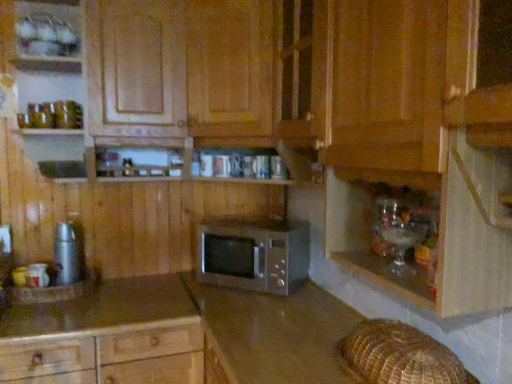
The width and height of the screenshot is (512, 384). Describe the element at coordinates (366, 241) in the screenshot. I see `translucent glassware at lower right` at that location.

The width and height of the screenshot is (512, 384). In order to click on smooth brown countertop at lower left in this screenshot , I will do `click(103, 309)`.

From the image's perspective, which is below, satin silver microwave at center or metallic silver thermos at left?

satin silver microwave at center appears lower in the image.

Is satin silver microwave at center oriented away from metallic silver thermos at left?

No.

Is metallic silver thermos at left inside satin silver microwave at center?

No, metallic silver thermos at left is located outside of satin silver microwave at center.

Does point (258, 224) appear closer or farther from the camera than point (76, 265)?

Point (258, 224) appears to be farther away from the viewer than point (76, 265).

Is satin brown microwave at center, acting as the second cabinetry starting from the top, at the left side of wooden microwave at center, marked as the 2th cabinetry in a bottom-to-top arrangement?

Correct, you'll find satin brown microwave at center, acting as the second cabinetry starting from the top, to the left of wooden microwave at center, marked as the 2th cabinetry in a bottom-to-top arrangement.

Does satin brown microwave at center, acting as the second cabinetry starting from the top, turn towards wooden microwave at center, marked as the 2th cabinetry in a bottom-to-top arrangement?

No, satin brown microwave at center, acting as the second cabinetry starting from the top, does not turn towards wooden microwave at center, marked as the 2th cabinetry in a bottom-to-top arrangement.

In the scene shown: Considering the relative sizes of satin brown microwave at center, the first cabinetry positioned from the bottom, and wooden microwave at center, marked as the 2th cabinetry in a bottom-to-top arrangement, in the image provided, is satin brown microwave at center, the first cabinetry positioned from the bottom, smaller than wooden microwave at center, marked as the 2th cabinetry in a bottom-to-top arrangement,?

Yes, satin brown microwave at center, the first cabinetry positioned from the bottom, is smaller than wooden microwave at center, marked as the 2th cabinetry in a bottom-to-top arrangement.

How many degrees apart are the facing directions of satin brown microwave at center, acting as the second cabinetry starting from the top, and wooden microwave at center, marked as the 2th cabinetry in a bottom-to-top arrangement?

The angular difference between satin brown microwave at center, acting as the second cabinetry starting from the top, and wooden microwave at center, marked as the 2th cabinetry in a bottom-to-top arrangement, is 2.12e-05 degrees.

Is metallic silver thermos at left to the right of wooden microwave at center, placed as the first cabinetry when sorted from top to bottom, from the viewer's perspective?

No, metallic silver thermos at left is not to the right of wooden microwave at center, placed as the first cabinetry when sorted from top to bottom.

Is there a large distance between metallic silver thermos at left and wooden microwave at center, marked as the 2th cabinetry in a bottom-to-top arrangement?

No, metallic silver thermos at left is not far away from wooden microwave at center, marked as the 2th cabinetry in a bottom-to-top arrangement.

Considering the positions of points (73, 265) and (138, 107), is point (73, 265) closer to camera compared to point (138, 107)?

No, it is not.

Considering the sizes of metallic silver thermos at left and wooden microwave at center, placed as the first cabinetry when sorted from top to bottom, in the image, is metallic silver thermos at left wider or thinner than wooden microwave at center, placed as the first cabinetry when sorted from top to bottom,?

metallic silver thermos at left is thinner than wooden microwave at center, placed as the first cabinetry when sorted from top to bottom.

Where is `shelf on the right of smooth brown countertop at lower left`? The width and height of the screenshot is (512, 384). shelf on the right of smooth brown countertop at lower left is located at coordinates (366, 241).

What's the angular difference between smooth brown countertop at lower left and translucent glassware at lower right's facing directions?

The angle between the facing direction of smooth brown countertop at lower left and the facing direction of translucent glassware at lower right is 89.6 degrees.

From the image's perspective, which is above, smooth brown countertop at lower left or translucent glassware at lower right?

translucent glassware at lower right appears higher in the image.

Considering the positions of objects smooth brown countertop at lower left and translucent glassware at lower right in the image provided, who is in front, smooth brown countertop at lower left or translucent glassware at lower right?

translucent glassware at lower right.

Can you tell me how much translucent glassware at lower right and satin brown microwave at center, the first cabinetry positioned from the bottom, differ in facing direction?

0.284 degrees separate the facing orientations of translucent glassware at lower right and satin brown microwave at center, the first cabinetry positioned from the bottom.

Choose the correct answer: Is translucent glassware at lower right inside satin brown microwave at center, acting as the second cabinetry starting from the top, or outside it?

translucent glassware at lower right is not enclosed by satin brown microwave at center, acting as the second cabinetry starting from the top.

Looking at this image, is translucent glassware at lower right oriented towards satin brown microwave at center, acting as the second cabinetry starting from the top?

No, translucent glassware at lower right is not oriented towards satin brown microwave at center, acting as the second cabinetry starting from the top.

Considering the sizes of objects satin silver microwave at center and wooden microwave at center, marked as the 2th cabinetry in a bottom-to-top arrangement, in the image provided, who is shorter, satin silver microwave at center or wooden microwave at center, marked as the 2th cabinetry in a bottom-to-top arrangement,?

With less height is satin silver microwave at center.

From a real-world perspective, is satin silver microwave at center above or below wooden microwave at center, marked as the 2th cabinetry in a bottom-to-top arrangement?

From a real-world perspective, satin silver microwave at center is physically below wooden microwave at center, marked as the 2th cabinetry in a bottom-to-top arrangement.

Looking at their sizes, would you say satin silver microwave at center is wider or thinner than wooden microwave at center, marked as the 2th cabinetry in a bottom-to-top arrangement?

Clearly, satin silver microwave at center has less width compared to wooden microwave at center, marked as the 2th cabinetry in a bottom-to-top arrangement.

Consider the image. Considering the positions of objects satin silver microwave at center and wooden microwave at center, placed as the first cabinetry when sorted from top to bottom, in the image provided, who is more to the right, satin silver microwave at center or wooden microwave at center, placed as the first cabinetry when sorted from top to bottom,?

satin silver microwave at center is more to the right.

Measure the distance from smooth brown countertop at lower left to wooden microwave at center, placed as the first cabinetry when sorted from top to bottom.

smooth brown countertop at lower left and wooden microwave at center, placed as the first cabinetry when sorted from top to bottom, are 32.95 inches apart from each other.

Is smooth brown countertop at lower left bigger than wooden microwave at center, marked as the 2th cabinetry in a bottom-to-top arrangement?

No, smooth brown countertop at lower left is not bigger than wooden microwave at center, marked as the 2th cabinetry in a bottom-to-top arrangement.

In the scene shown: Considering the positions of objects smooth brown countertop at lower left and wooden microwave at center, placed as the first cabinetry when sorted from top to bottom, in the image provided, who is in front, smooth brown countertop at lower left or wooden microwave at center, placed as the first cabinetry when sorted from top to bottom,?

wooden microwave at center, placed as the first cabinetry when sorted from top to bottom, is more forward.

From the image's perspective, is smooth brown countertop at lower left above or below wooden microwave at center, placed as the first cabinetry when sorted from top to bottom?

Based on their image positions, smooth brown countertop at lower left is located beneath wooden microwave at center, placed as the first cabinetry when sorted from top to bottom.

This screenshot has width=512, height=384. I want to click on appliance on the left of the satin silver microwave at center, so point(66,254).

Where is `cabinetry above the satin brown microwave at center, the first cabinetry positioned from the bottom (from a real-world perspective)`? The width and height of the screenshot is (512, 384). cabinetry above the satin brown microwave at center, the first cabinetry positioned from the bottom (from a real-world perspective) is located at coordinates (301, 78).

Based on their spatial positions, is metallic silver thermos at left or satin silver microwave at center further from satin brown microwave at center, acting as the second cabinetry starting from the top?

The object further to satin brown microwave at center, acting as the second cabinetry starting from the top, is metallic silver thermos at left.

Looking at the image, which one is located further to metallic silver thermos at left, satin brown microwave at center, the first cabinetry positioned from the bottom, or translucent glassware at lower right?

translucent glassware at lower right is further to metallic silver thermos at left.

Estimate the real-world distances between objects in this image. Which object is further from satin brown microwave at center, the first cabinetry positioned from the bottom, translucent glassware at lower right or satin silver microwave at center?

Based on the image, translucent glassware at lower right appears to be further to satin brown microwave at center, the first cabinetry positioned from the bottom.

From the image, which object appears to be farther from satin silver microwave at center, translucent glassware at lower right or satin brown microwave at center, acting as the second cabinetry starting from the top?

translucent glassware at lower right is further to satin silver microwave at center.

From the picture: Based on their spatial positions, is satin silver microwave at center or metallic silver thermos at left closer to wooden microwave at center, placed as the first cabinetry when sorted from top to bottom?

Based on the image, satin silver microwave at center appears to be nearer to wooden microwave at center, placed as the first cabinetry when sorted from top to bottom.

Which object lies nearer to the anchor point translucent glassware at lower right, metallic silver thermos at left or smooth brown countertop at lower left?

The object closer to translucent glassware at lower right is smooth brown countertop at lower left.

Looking at this image, estimate the real-world distances between objects in this image. Which object is further from satin brown microwave at center, the first cabinetry positioned from the bottom, satin silver microwave at center or metallic silver thermos at left?

metallic silver thermos at left lies further to satin brown microwave at center, the first cabinetry positioned from the bottom, than the other object.

Which object lies nearer to the anchor point metallic silver thermos at left, satin silver microwave at center or wooden microwave at center, marked as the 2th cabinetry in a bottom-to-top arrangement?

satin silver microwave at center lies closer to metallic silver thermos at left than the other object.

This screenshot has height=384, width=512. Identify the location of countertop located between wooden microwave at center, marked as the 2th cabinetry in a bottom-to-top arrangement, and satin silver microwave at center in the depth direction. (103, 309).

You are a GUI agent. You are given a task and a screenshot of the screen. Output one action in this format:
    pyautogui.click(x=<x>, y=<y>)
    Task: Click on the cabinetry positioned between wooden microwave at center, marked as the 2th cabinetry in a bottom-to-top arrangement, and satin silver microwave at center from near to far
    This screenshot has height=384, width=512.
    Given the screenshot: What is the action you would take?
    pyautogui.click(x=175, y=335)

This screenshot has height=384, width=512. What are the coordinates of `countertop between metallic silver thermos at left and satin silver microwave at center from left to right` in the screenshot? It's located at (103, 309).

At what (x,y) coordinates should I click in order to perform the action: click on shelf positioned between satin brown microwave at center, acting as the second cabinetry starting from the top, and satin silver microwave at center from near to far. Please return your answer as a coordinate pair (x, y). The height and width of the screenshot is (384, 512). Looking at the image, I should click on (366, 241).